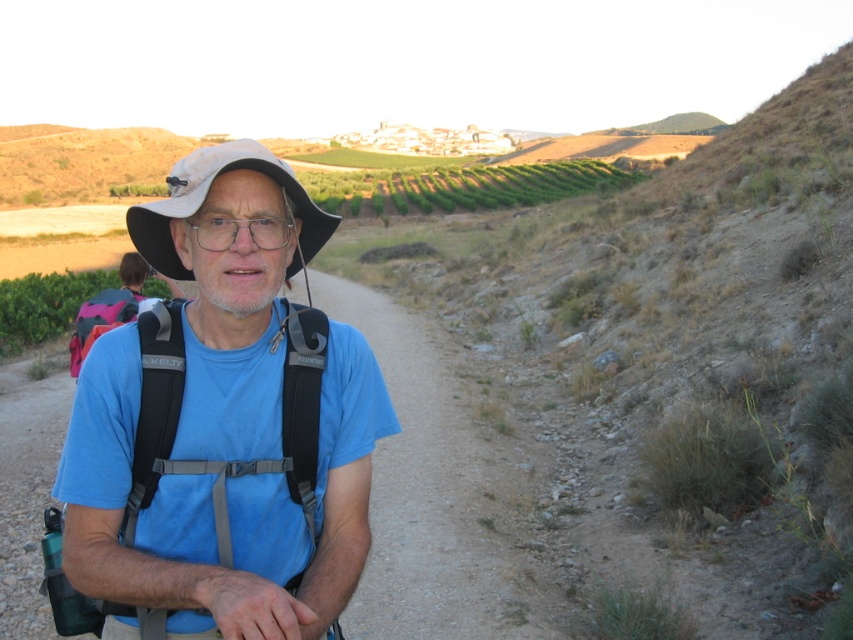
You are a photographer aiming to capture a closeup shot of the white fabric hat at center and transparent plastic glasses at center. Your camera has a maximum focus range of 3 inches. Can you take a photo of both objects without moving your camera?

The white fabric hat at center is 2.90 inches from transparent plastic glasses at center. Since the distance between them is within the camera maximum focus range of 3 inches, you can take a photo of both objects without moving your camera.